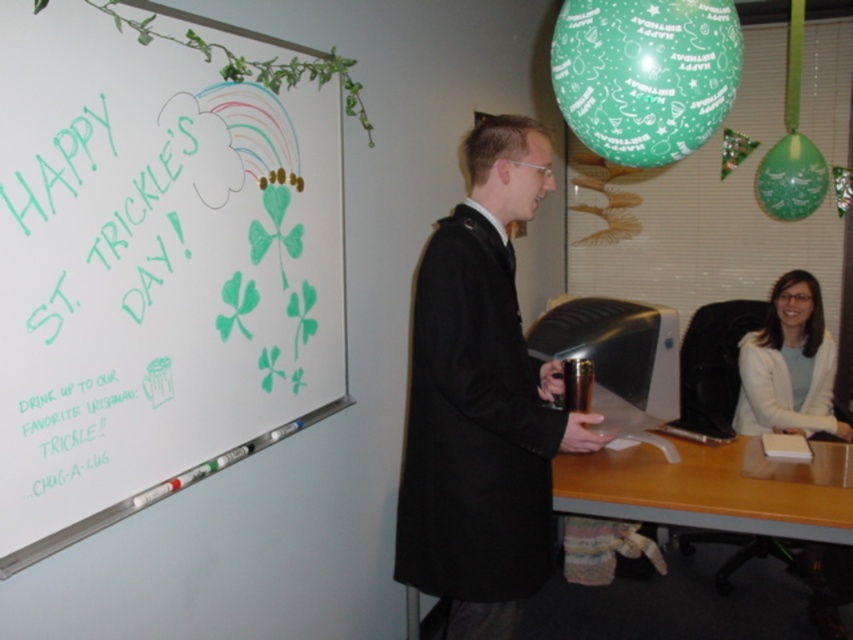
You are a photographer taking a picture of the whiteboard at upper left and the white fabric shirt at right. Which object will appear larger in the photo?

The whiteboard at upper left will appear larger in the photo because it is closer to the viewer than the white fabric shirt at right.

You are organizing a St. Patrick Day event and need to place a decorative banner between the green chalk writing at upper left and the wooden desk at lower right. According to the scene, where should the banner be placed relative to these two objects?

The green chalk writing at upper left is located above the wooden desk at lower right, so the banner should be placed between them in the middle area between the upper left and lower right positions.

You are organizing a St. Patrick Day event and need to arrange the black wool coat at center and the white fabric shirt at right for a photo shoot. Based on their current positions, which clothing item is located lower in the frame?

The black wool coat at center is positioned under the white fabric shirt at right, so it is located lower in the frame.